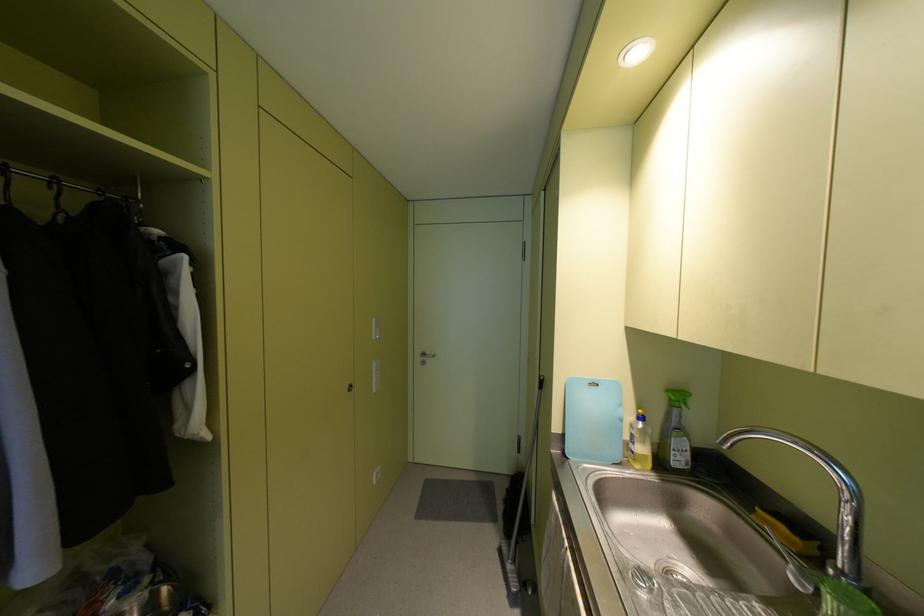
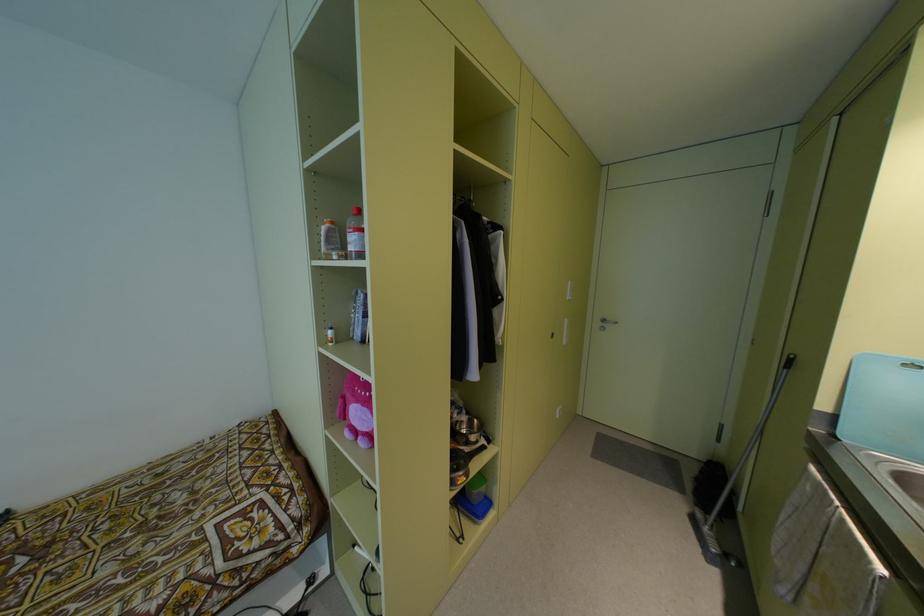
Question: Based on the continuous images, in which direction is the camera rotating? Reply with the corresponding letter.

Choices:
 (A) Left
 (B) Right
 (C) Up
 (D) Down

Answer: (A)